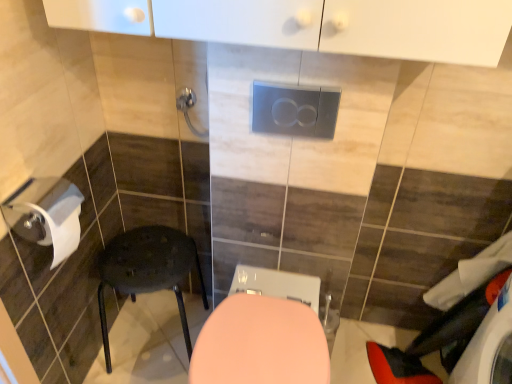
Locate an element on the screen. The image size is (512, 384). vacant space underneath matte black stool at lower left (from a real-world perspective) is located at coordinates (154, 345).